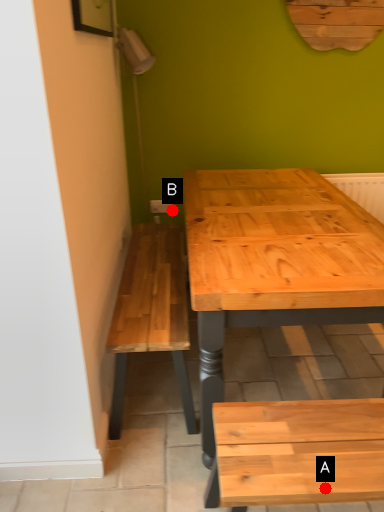
Question: Two points are circled on the image, labeled by A and B beside each circle. Which point appears closest to the camera in this image?

Choices:
 (A) A is closer
 (B) B is closer

Answer: (A)